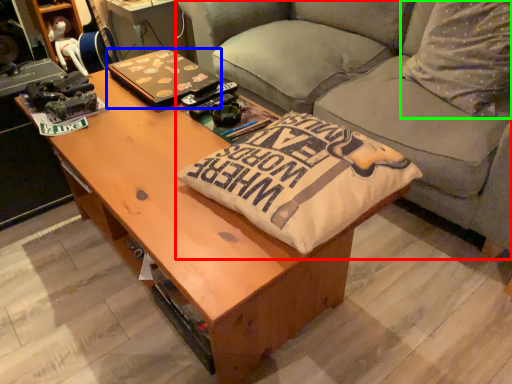
Question: Which object is the farthest from studio couch (highlighted by a red box)? Choose among these: laptop (highlighted by a blue box) or throw pillow (highlighted by a green box).

Choices:
 (A) laptop
 (B) throw pillow

Answer: (A)